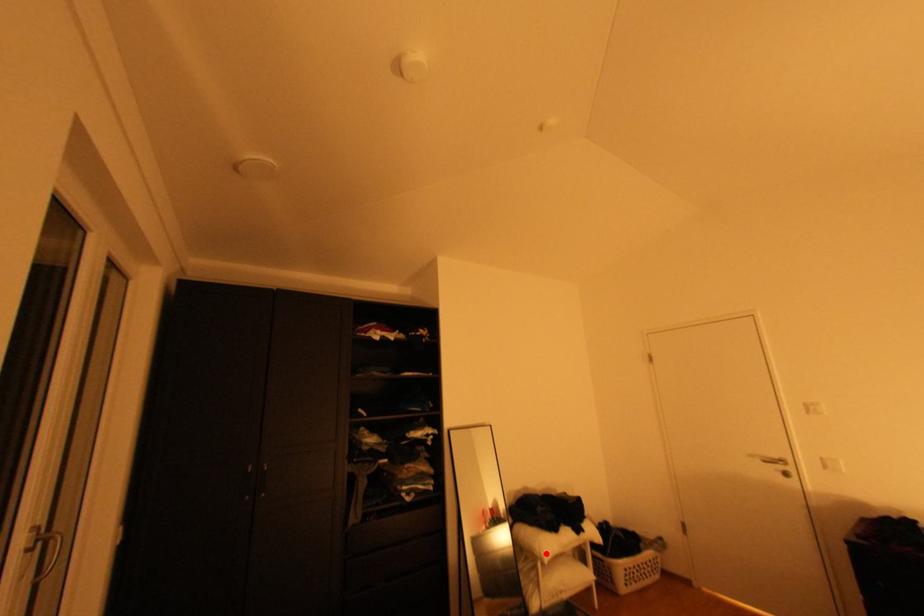
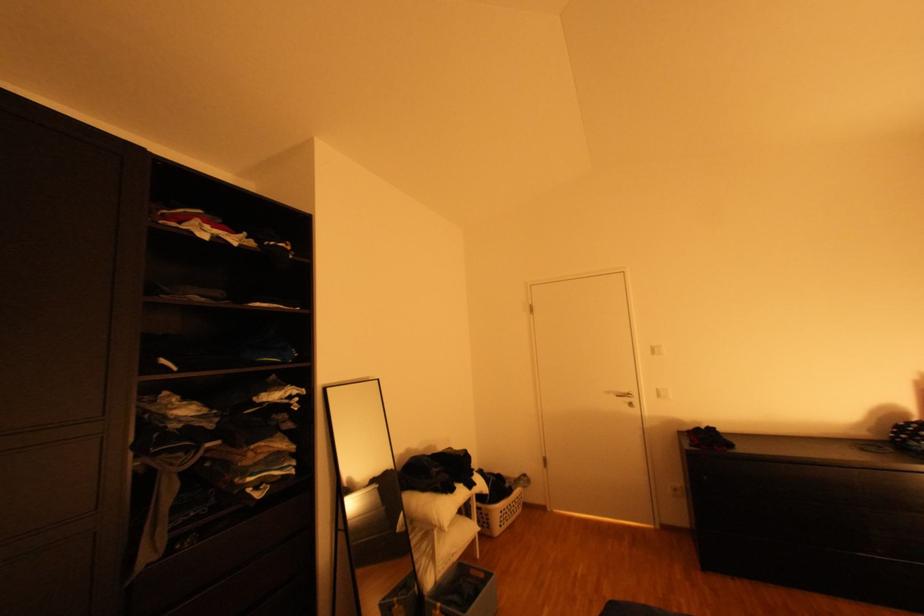
The point at the highlighted location is marked in the first image. Where is the corresponding point in the second image?

(444, 523)